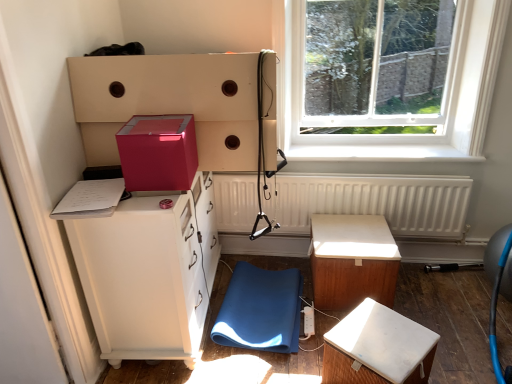
Question: Is matte pink cube at upper center at the right side of matte white cabinet at left?

Choices:
 (A) no
 (B) yes

Answer: (B)

Question: Is the surface of matte pink cube at upper center in direct contact with matte white cabinet at left?

Choices:
 (A) no
 (B) yes

Answer: (A)

Question: Does matte pink cube at upper center have a greater height compared to matte white cabinet at left?

Choices:
 (A) no
 (B) yes

Answer: (A)

Question: From the image's perspective, would you say matte pink cube at upper center is positioned over matte white cabinet at left?

Choices:
 (A) yes
 (B) no

Answer: (A)

Question: Is matte pink cube at upper center outside of matte white cabinet at left?

Choices:
 (A) yes
 (B) no

Answer: (A)

Question: Can you confirm if matte pink cube at upper center is thinner than matte white cabinet at left?

Choices:
 (A) yes
 (B) no

Answer: (B)

Question: Considering the relative positions of matte pink box at upper left and white plastic power strip at lower center in the image provided, is matte pink box at upper left to the right of white plastic power strip at lower center from the viewer's perspective?

Choices:
 (A) yes
 (B) no

Answer: (B)

Question: Is matte pink box at upper left at the left side of white plastic power strip at lower center?

Choices:
 (A) yes
 (B) no

Answer: (A)

Question: From the image's perspective, does matte pink box at upper left appear higher than white plastic power strip at lower center?

Choices:
 (A) no
 (B) yes

Answer: (B)

Question: Can you confirm if matte pink box at upper left is shorter than white plastic power strip at lower center?

Choices:
 (A) no
 (B) yes

Answer: (A)

Question: Is matte pink box at upper left positioned beyond the bounds of white plastic power strip at lower center?

Choices:
 (A) yes
 (B) no

Answer: (A)

Question: Is matte pink box at upper left not close to white plastic power strip at lower center?

Choices:
 (A) yes
 (B) no

Answer: (A)

Question: Considering the relative sizes of blue fabric swivel chair at lower center and transparent glass window at upper right in the image provided, is blue fabric swivel chair at lower center taller than transparent glass window at upper right?

Choices:
 (A) no
 (B) yes

Answer: (A)